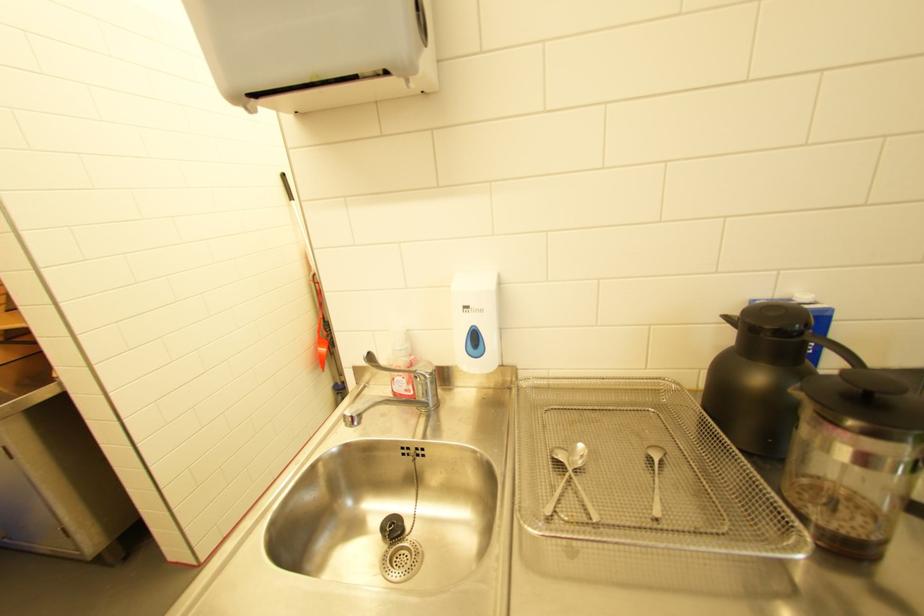
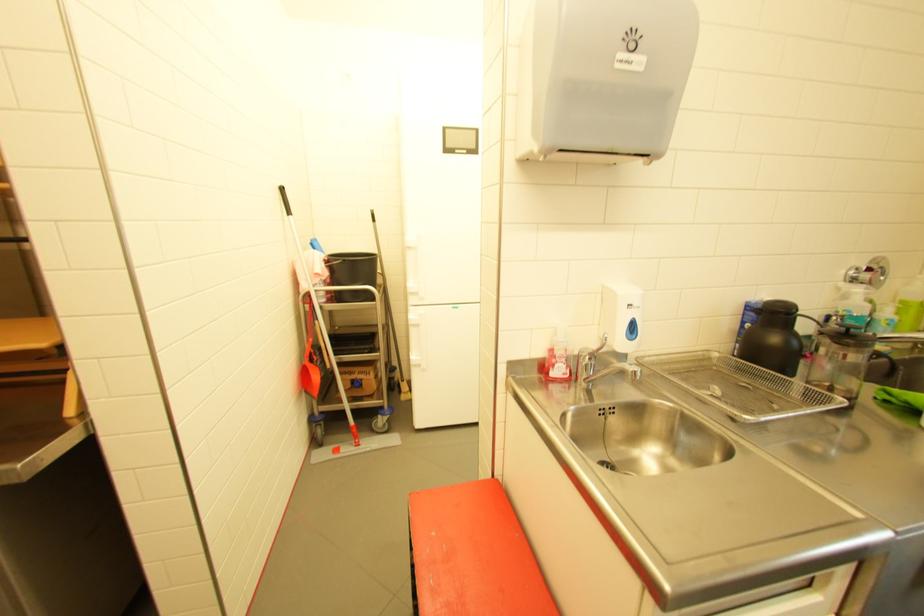
Locate, in the second image, the point that corresponds to [766,379] in the first image.

(782, 339)